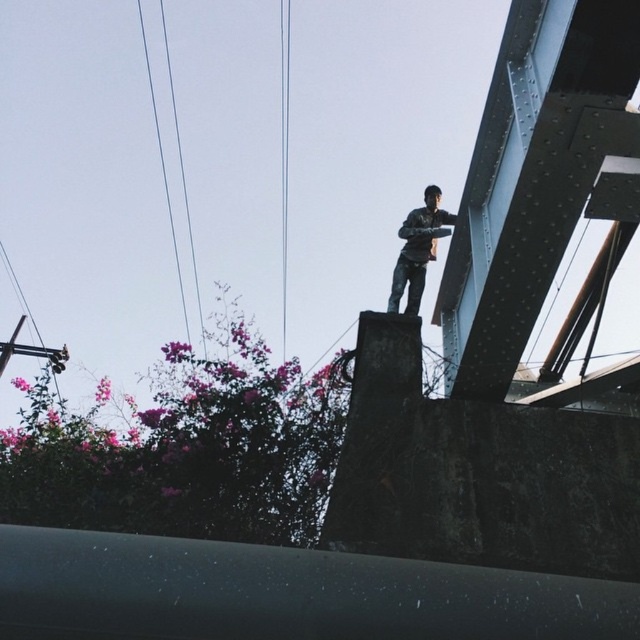
You are standing under the bridge and see the dark gray jeans at center and the metallic wire at center. Which object is positioned more to the right?

The dark gray jeans at center is positioned more to the right than the metallic wire at center.